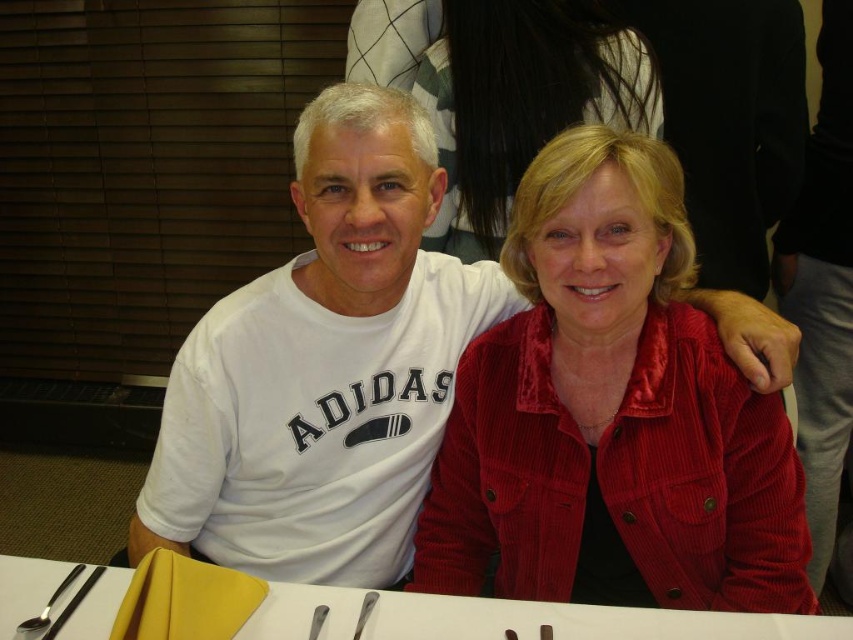
Who is shorter, satin red jacket at center or white plastic table at lower center?

white plastic table at lower center is shorter.

Does satin red jacket at center have a larger size compared to white plastic table at lower center?

Yes.

Which is behind, point (492, 451) or point (10, 568)?

Point (492, 451)

Locate an element on the screen. satin red jacket at center is located at coordinates (611, 410).

Is satin red jacket at center positioned behind polished silver spoon at lower left?

Yes, satin red jacket at center is behind polished silver spoon at lower left.

Which of these two, satin red jacket at center or polished silver spoon at lower left, stands taller?

Standing taller between the two is satin red jacket at center.

Find the location of a particular element. Image resolution: width=853 pixels, height=640 pixels. satin red jacket at center is located at coordinates (611, 410).

The height and width of the screenshot is (640, 853). I want to click on satin red jacket at center, so click(x=611, y=410).

Who is more forward, (x=119, y=572) or (x=32, y=637)?

Point (x=32, y=637)

Which is below, white plastic table at lower center or polished silver spoon at lower left?

Positioned lower is white plastic table at lower center.

Is point (374, 625) in front of point (62, 580)?

Yes, it is.

Find the location of a particular element. white plastic table at lower center is located at coordinates pyautogui.click(x=579, y=621).